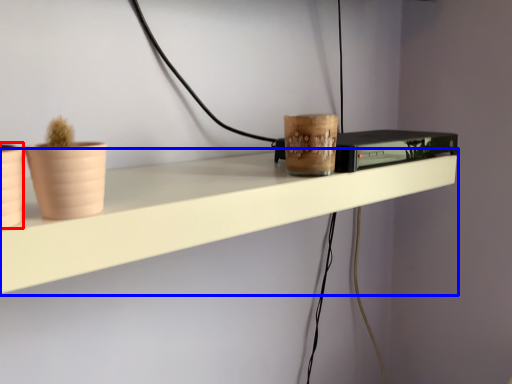
Question: Which object appears closest to the camera in this image, flowerpot (highlighted by a red box) or shelf (highlighted by a blue box)?

Choices:
 (A) flowerpot
 (B) shelf

Answer: (A)